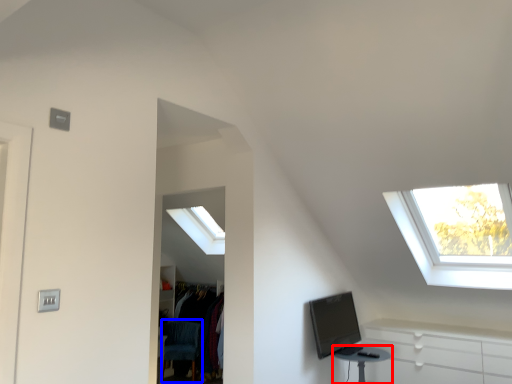
Question: Which object appears closest to the camera in this image, table (highlighted by a red box) or swivel chair (highlighted by a blue box)?

Choices:
 (A) table
 (B) swivel chair

Answer: (A)